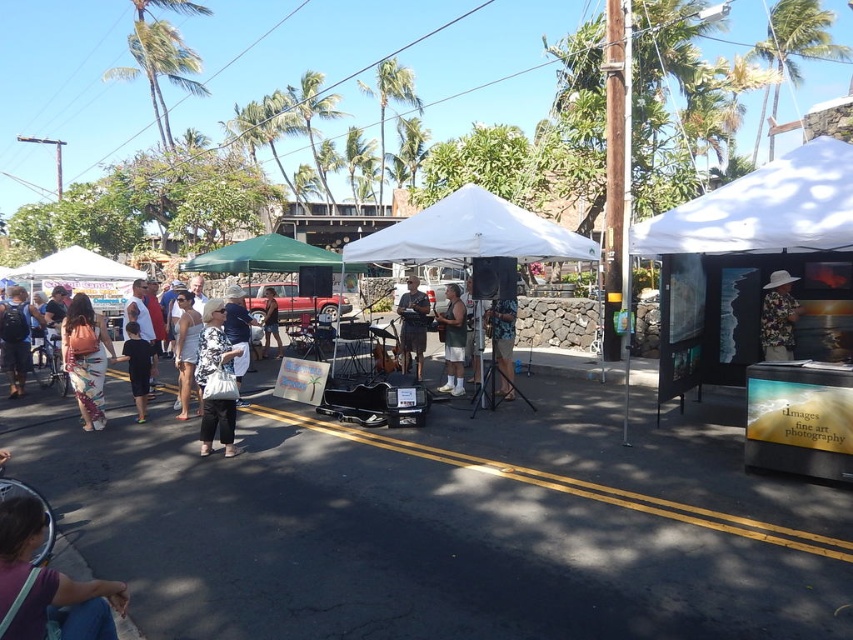
In the scene shown: You are a customer at the market and want to buy both the matte gray shirt at center and the black cotton shirt at lower left. However, you have a limited budget. The vendor tells you that the price of the shirt higher up is 20 dollars more expensive than the one below. Which shirt should you buy to stay within your budget?

The matte gray shirt at center is positioned over the black cotton shirt at lower left, meaning it is higher up. Since the vendor mentioned the higher shirt is 20 dollars more expensive, you should buy the black cotton shirt at lower left to stay within your budget.

You are a photographer trying to capture both the matte gray shirt at center and the black cotton shirt at lower left in a single frame. Which shirt should you focus on first to ensure both are in the shot?

The matte gray shirt at center is not as tall as the black cotton shirt at lower left, so you should focus on the black cotton shirt at lower left first to ensure both are in the shot since it is taller and will require more framing space.

You are a visitor at this event and want to find the main entrance. You notice the white fabric tent at center and the white fabric canopy at upper left. Which one is located to the right of the other?

The white fabric tent at center is positioned on the right side of white fabric canopy at upper left.